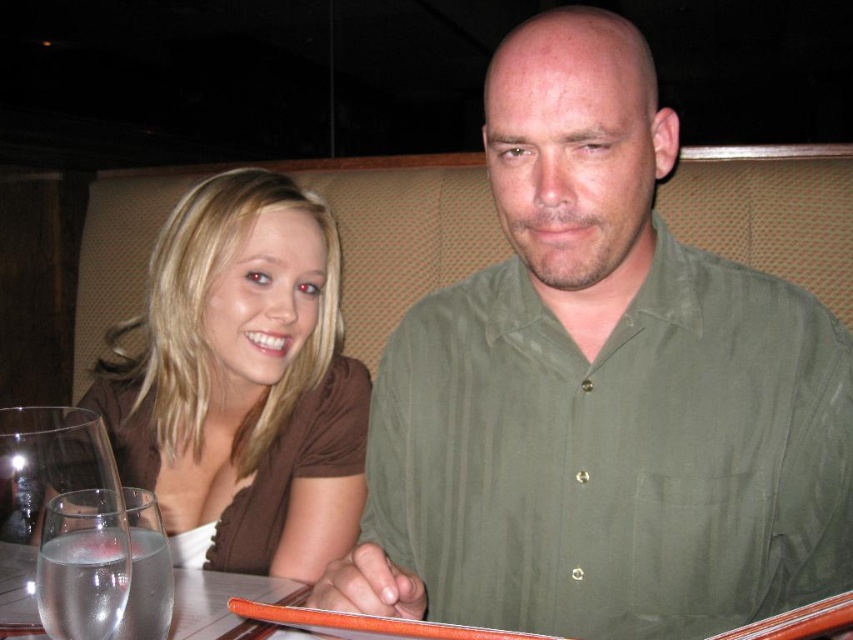
You are a photographer trying to capture a candid shot of the brown matte shirt at upper left and the clear glass wine glass at lower left. Since you want both subjects to be in focus, which one should you focus on first to ensure the other is also in focus?

The brown matte shirt at upper left is much taller than the clear glass wine glass at lower left. Therefore, focusing on the brown matte shirt at upper left first will ensure the clear glass wine glass at lower left is also in focus due to its closer proximity to the background.

You are a waiter in a restaurant. You need to place a new drink order for the customer wearing the brown matte shirt at upper left. Where should you place the drink relative to the clear glass wine glass at lower left?

The brown matte shirt at upper left is to the left of the clear glass wine glass at lower left, so you should place the new drink to the right of the clear glass wine glass at lower left to avoid blocking the customer.